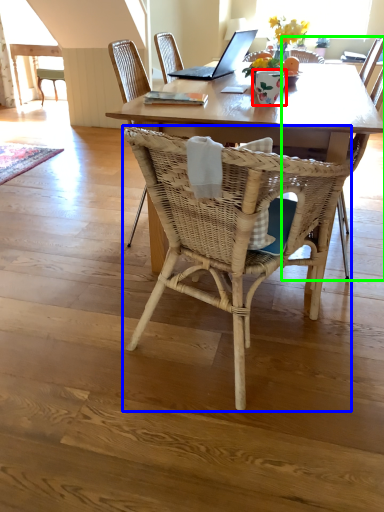
Question: Considering the real-world distances, which object is closest to vase (highlighted by a red box)? chair (highlighted by a blue box) or armchair (highlighted by a green box).

Choices:
 (A) chair
 (B) armchair

Answer: (B)